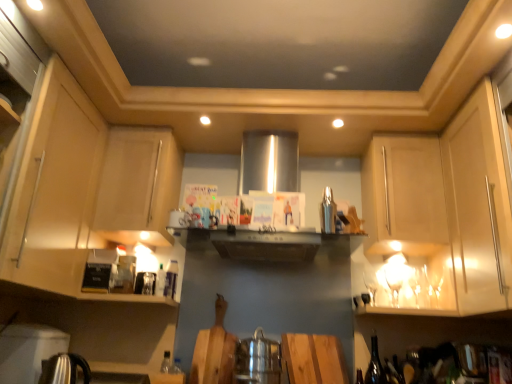
Question: Is the depth of translucent glass bottle at lower center, which appears as the 2th bottle when viewed from the right, greater than that of satin silver shaker at upper center, placed as the 1th appliance when sorted from right to left?

Choices:
 (A) no
 (B) yes

Answer: (B)

Question: Is satin silver shaker at upper center, the first appliance viewed from the top, located within translucent glass bottle at lower center, which appears as the 2th bottle when viewed from the right?

Choices:
 (A) yes
 (B) no

Answer: (B)

Question: Is translucent glass bottle at lower center, the 1th bottle in the left-to-right sequence, facing towards satin silver shaker at upper center, the third appliance positioned from the left?

Choices:
 (A) no
 (B) yes

Answer: (A)

Question: Does translucent glass bottle at lower center, which appears as the 2th bottle when viewed from the right, have a larger size compared to satin silver shaker at upper center, acting as the 3th appliance starting from the bottom?

Choices:
 (A) yes
 (B) no

Answer: (B)

Question: Considering the relative sizes of translucent glass bottle at lower center, which appears as the 2th bottle when viewed from the right, and satin silver shaker at upper center, acting as the 3th appliance starting from the bottom, in the image provided, is translucent glass bottle at lower center, which appears as the 2th bottle when viewed from the right, taller than satin silver shaker at upper center, acting as the 3th appliance starting from the bottom,?

Choices:
 (A) yes
 (B) no

Answer: (B)

Question: From a real-world perspective, is translucent glass bottle at lower center, the 1th bottle in the left-to-right sequence, located beneath satin silver shaker at upper center, acting as the 3th appliance starting from the bottom?

Choices:
 (A) no
 (B) yes

Answer: (B)

Question: From the image's perspective, would you say matte wood cabinet at left, which is the 5th cabinetry from right to left, is shown under wooden cutting board at center, which is the second plywood in left-to-right order?

Choices:
 (A) no
 (B) yes

Answer: (A)

Question: Is matte wood cabinet at left, which is the 5th cabinetry from right to left, positioned beyond the bounds of wooden cutting board at center, which appears as the first plywood when viewed from the right?

Choices:
 (A) no
 (B) yes

Answer: (B)

Question: Does matte wood cabinet at left, which is the 5th cabinetry from right to left, have a lesser width compared to wooden cutting board at center, which is the second plywood in left-to-right order?

Choices:
 (A) no
 (B) yes

Answer: (A)

Question: Considering the relative positions of matte wood cabinet at left, which is the 5th cabinetry from right to left, and wooden cutting board at center, which appears as the first plywood when viewed from the right, in the image provided, is matte wood cabinet at left, which is the 5th cabinetry from right to left, to the left of wooden cutting board at center, which appears as the first plywood when viewed from the right, from the viewer's perspective?

Choices:
 (A) no
 (B) yes

Answer: (B)

Question: Does matte wood cabinet at left, the 1th cabinetry when ordered from left to right, have a lesser height compared to wooden cutting board at center, which appears as the first plywood when viewed from the right?

Choices:
 (A) no
 (B) yes

Answer: (A)

Question: From the image's perspective, is matte wood cabinet at left, which is the 5th cabinetry from right to left, on wooden cutting board at center, which appears as the first plywood when viewed from the right?

Choices:
 (A) no
 (B) yes

Answer: (B)

Question: Could you tell me if matte wood cabinet at left, the 1th cabinetry when ordered from left to right, is facing matte wood cabinet at right, which is the 2th cabinetry in right-to-left order?

Choices:
 (A) yes
 (B) no

Answer: (A)